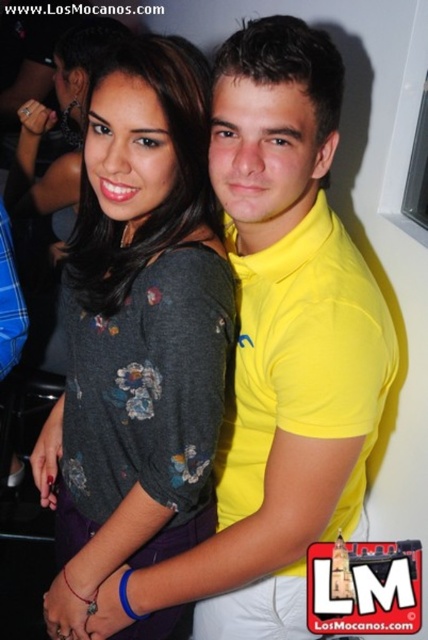
You are organizing a charity event and need to display two shirts on a mannequin. The yellow cotton polo shirt at center and the dark gray floral shirt at center must be arranged so that the larger one is on top. Which shirt should you place on top?

The yellow cotton polo shirt at center is larger in size than the dark gray floral shirt at center, so you should place the yellow cotton polo shirt at center on top.

You are at a party and want to take a photo of the yellow cotton polo shirt at center and the dark gray floral shirt at center. Which one should you focus on first if you want to capture both in the frame without moving the camera?

You should focus on the dark gray floral shirt at center first because it is on the left side of the yellow cotton polo shirt at center, so capturing it first ensures both are in the frame without needing to adjust the camera position.

You are at an indoor event and want to take a photo of the point at coordinates (270,353). The camera you are using has a minimum focus distance of 30 inches. Will the camera be able to focus on the point?

The point at coordinates (270,353) is 33.18 inches from the camera, which is beyond the minimum focus distance of 30 inches. Therefore, the camera should be able to focus on the point.